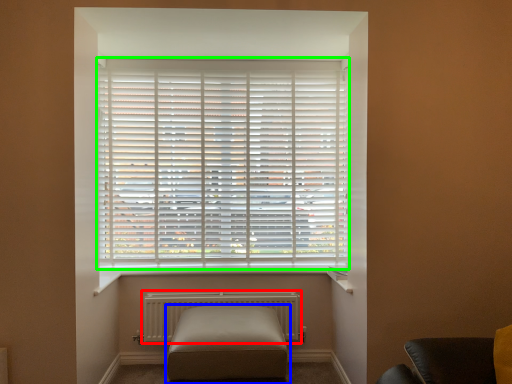
Question: Estimate the real-world distances between objects in this image. Which object is farther from radiator (highlighted by a red box), furniture (highlighted by a blue box) or window blind (highlighted by a green box)?

Choices:
 (A) furniture
 (B) window blind

Answer: (B)